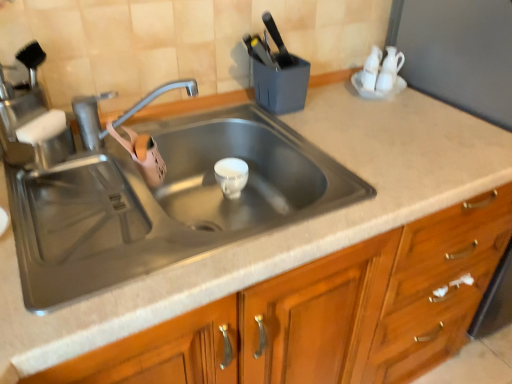
The image size is (512, 384). I want to click on stainless steel sink at center, so click(x=164, y=202).

You are a GUI agent. You are given a task and a screenshot of the screen. Output one action in this format:
    pyautogui.click(x=<x>, y=<y>)
    Task: Click on the satin nickel faucet at upper left
    
    Given the screenshot: What is the action you would take?
    pyautogui.click(x=90, y=120)

The image size is (512, 384). I want to click on stainless steel sink at center, so click(x=164, y=202).

How different are the orientations of wooden cabinet at center and stainless steel sink at center in degrees?

0.926 degrees.

Is wooden cabinet at center situated inside stainless steel sink at center or outside?

wooden cabinet at center lies outside stainless steel sink at center.

Does point (497, 192) appear closer or farther from the camera than point (230, 212)?

Point (497, 192) is closer to the camera than point (230, 212).

Consider the image. Which of these two, wooden cabinet at center or stainless steel sink at center, stands taller?

With more height is wooden cabinet at center.

Could you tell me if satin nickel faucet at upper left is turned towards wooden cabinet at center?

No, satin nickel faucet at upper left is not aimed at wooden cabinet at center.

Considering the sizes of objects satin nickel faucet at upper left and wooden cabinet at center in the image provided, who is taller, satin nickel faucet at upper left or wooden cabinet at center?

With more height is wooden cabinet at center.

Considering the sizes of objects satin nickel faucet at upper left and wooden cabinet at center in the image provided, who is thinner, satin nickel faucet at upper left or wooden cabinet at center?

Thinner between the two is satin nickel faucet at upper left.

Is satin nickel faucet at upper left beside wooden cabinet at center?

satin nickel faucet at upper left and wooden cabinet at center are clearly separated.

Which point is more forward, (55,188) or (492,252)?

The point (55,188) is more forward.

From their relative heights in the image, would you say stainless steel sink at center is taller or shorter than wooden cabinet at center?

Clearly, stainless steel sink at center is shorter compared to wooden cabinet at center.

Relative to wooden cabinet at center, is stainless steel sink at center in front or behind?

stainless steel sink at center is behind wooden cabinet at center.

Does stainless steel sink at center have a greater width compared to wooden cabinet at center?

In fact, stainless steel sink at center might be narrower than wooden cabinet at center.

Is wooden cabinet at center turned away from satin nickel faucet at upper left?

wooden cabinet at center is not turned away from satin nickel faucet at upper left.

Which object is closer to the camera taking this photo, wooden cabinet at center or satin nickel faucet at upper left?

wooden cabinet at center is more forward.

From a real-world perspective, which is physically above, wooden cabinet at center or satin nickel faucet at upper left?

satin nickel faucet at upper left, from a real-world perspective.

Are stainless steel sink at center and satin nickel faucet at upper left located far from each other?

No, there isn't a large distance between stainless steel sink at center and satin nickel faucet at upper left.

Considering the positions of points (20, 263) and (190, 87), is point (20, 263) farther from camera compared to point (190, 87)?

No, (20, 263) is closer to viewer.

Does stainless steel sink at center come in front of satin nickel faucet at upper left?

That is True.

Which is more to the right, stainless steel sink at center or satin nickel faucet at upper left?

stainless steel sink at center.

Is satin nickel faucet at upper left to the left or to the right of stainless steel sink at center in the image?

satin nickel faucet at upper left is positioned on stainless steel sink at center's left side.

How many degrees apart are the facing directions of satin nickel faucet at upper left and stainless steel sink at center?

satin nickel faucet at upper left and stainless steel sink at center are facing 66.8 degrees away from each other.

Is satin nickel faucet at upper left taller or shorter than stainless steel sink at center?

Clearly, satin nickel faucet at upper left is shorter compared to stainless steel sink at center.

At what (x,y) coordinates should I click in order to perform the action: click on sink above the wooden cabinet at center (from the image's perspective). Please return your answer as a coordinate pair (x, y). This screenshot has width=512, height=384. Looking at the image, I should click on (164, 202).

Find the location of a particular element. The width and height of the screenshot is (512, 384). tap on the left of wooden cabinet at center is located at coordinates (90, 120).

Considering their positions, is stainless steel sink at center positioned further to satin nickel faucet at upper left than wooden cabinet at center?

Based on the image, wooden cabinet at center appears to be further to satin nickel faucet at upper left.

Consider the image. When comparing their distances from stainless steel sink at center, does wooden cabinet at center or satin nickel faucet at upper left seem closer?

satin nickel faucet at upper left.

When comparing their distances from wooden cabinet at center, does satin nickel faucet at upper left or stainless steel sink at center seem closer?

stainless steel sink at center is closer to wooden cabinet at center.

From the image, which object appears to be nearer to wooden cabinet at center, stainless steel sink at center or satin nickel faucet at upper left?

stainless steel sink at center lies closer to wooden cabinet at center than the other object.

Which object lies nearer to the anchor point satin nickel faucet at upper left, wooden cabinet at center or stainless steel sink at center?

Based on the image, stainless steel sink at center appears to be nearer to satin nickel faucet at upper left.

Considering their positions, is satin nickel faucet at upper left positioned closer to stainless steel sink at center than wooden cabinet at center?

Among the two, satin nickel faucet at upper left is located nearer to stainless steel sink at center.

At what (x,y) coordinates should I click in order to perform the action: click on sink between satin nickel faucet at upper left and wooden cabinet at center from top to bottom. Please return your answer as a coordinate pair (x, y). The height and width of the screenshot is (384, 512). Looking at the image, I should click on (164, 202).